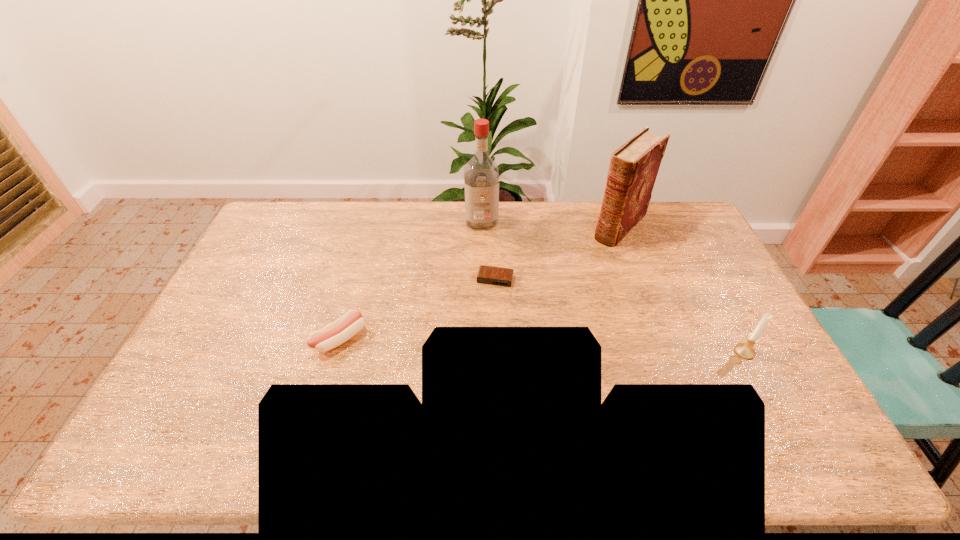
Image resolution: width=960 pixels, height=540 pixels. In order to click on vacant region between the shortest object and the hardback book in this screenshot , I will do `click(558, 253)`.

Image resolution: width=960 pixels, height=540 pixels. I want to click on vacant region between the liquor and the fourth shortest object, so click(551, 224).

Image resolution: width=960 pixels, height=540 pixels. What are the coordinates of `free spot between the liquor and the leftmost object` in the screenshot? It's located at (411, 280).

Find the location of a particular element. free space between the rightmost object and the second object from right to left is located at coordinates (683, 289).

This screenshot has width=960, height=540. Identify the location of free space between the second object from right to left and the shortest object. (558, 253).

You are a GUI agent. You are given a task and a screenshot of the screen. Output one action in this format:
    pyautogui.click(x=<x>, y=<y>)
    Task: Click on the unoccupied area between the second tallest object and the liquor
    The width and height of the screenshot is (960, 540).
    Given the screenshot: What is the action you would take?
    pyautogui.click(x=551, y=224)

Find the location of a particular element. The width and height of the screenshot is (960, 540). free space between the second shortest object and the third nearest object is located at coordinates (418, 309).

The image size is (960, 540). What are the coordinates of `free point between the candle holder and the liquor` in the screenshot? It's located at (612, 286).

The image size is (960, 540). Find the location of `vacant space in between the third tallest object and the leftmost object`. vacant space in between the third tallest object and the leftmost object is located at coordinates (542, 345).

What are the coordinates of `free space between the fourth tallest object and the third farthest object` in the screenshot? It's located at (418, 309).